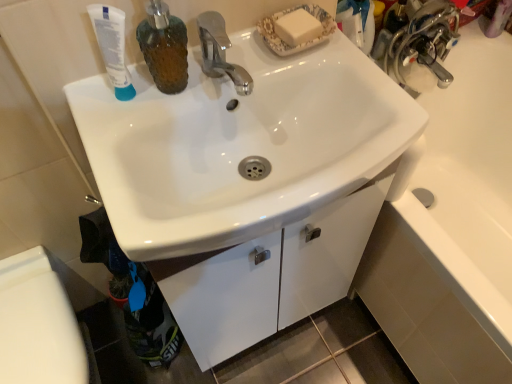
Question: Is white matte tube at upper left further to the viewer compared to white glossy cabinet at lower center?

Choices:
 (A) no
 (B) yes

Answer: (A)

Question: Considering the relative positions of white matte tube at upper left and white glossy cabinet at lower center in the image provided, is white matte tube at upper left to the right of white glossy cabinet at lower center from the viewer's perspective?

Choices:
 (A) yes
 (B) no

Answer: (B)

Question: From a real-world perspective, is white matte tube at upper left beneath white glossy cabinet at lower center?

Choices:
 (A) no
 (B) yes

Answer: (A)

Question: Is white matte tube at upper left not within white glossy cabinet at lower center?

Choices:
 (A) yes
 (B) no

Answer: (A)

Question: Would you consider white matte tube at upper left to be distant from white glossy cabinet at lower center?

Choices:
 (A) yes
 (B) no

Answer: (B)

Question: Is white matte tube at upper left oriented towards white glossy cabinet at lower center?

Choices:
 (A) yes
 (B) no

Answer: (B)

Question: Considering the relative sizes of white glossy cabinet at lower center and white glossy toilet bowl at lower left in the image provided, is white glossy cabinet at lower center shorter than white glossy toilet bowl at lower left?

Choices:
 (A) yes
 (B) no

Answer: (A)

Question: Does white glossy cabinet at lower center appear on the left side of white glossy toilet bowl at lower left?

Choices:
 (A) yes
 (B) no

Answer: (B)

Question: Considering the relative sizes of white glossy cabinet at lower center and white glossy toilet bowl at lower left in the image provided, is white glossy cabinet at lower center bigger than white glossy toilet bowl at lower left?

Choices:
 (A) no
 (B) yes

Answer: (A)

Question: Is white glossy cabinet at lower center facing away from white glossy toilet bowl at lower left?

Choices:
 (A) yes
 (B) no

Answer: (B)

Question: Can you confirm if white glossy cabinet at lower center is thinner than white glossy toilet bowl at lower left?

Choices:
 (A) yes
 (B) no

Answer: (B)

Question: Is the position of white glossy cabinet at lower center less distant than that of white glossy toilet bowl at lower left?

Choices:
 (A) yes
 (B) no

Answer: (B)

Question: Is white glossy cabinet at lower center to the left of white matte tube at upper left from the viewer's perspective?

Choices:
 (A) yes
 (B) no

Answer: (B)